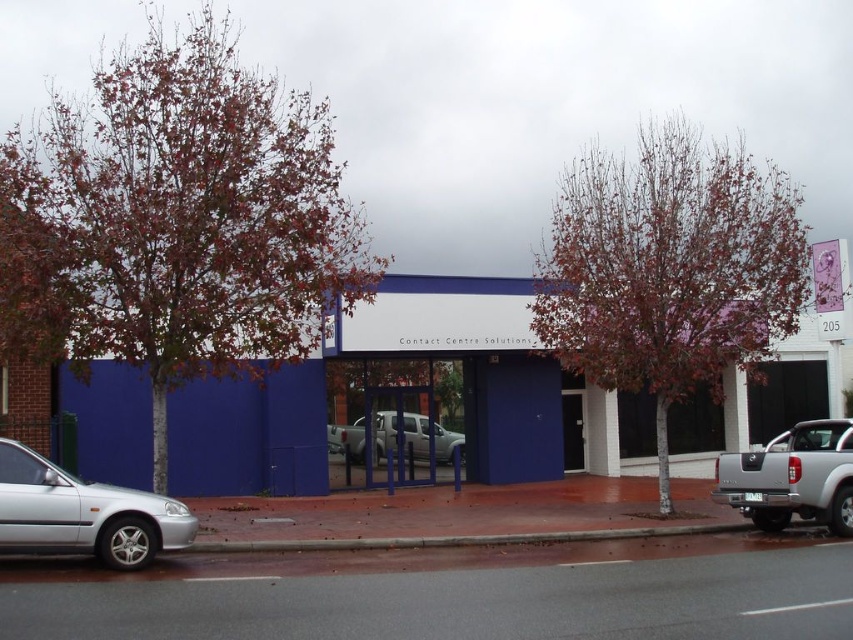
Is brown leafy tree at center taller than brown concrete curb at lower center?

Yes, brown leafy tree at center is taller than brown concrete curb at lower center.

The height and width of the screenshot is (640, 853). Describe the element at coordinates (670, 268) in the screenshot. I see `brown leafy tree at center` at that location.

This screenshot has width=853, height=640. In order to click on brown leafy tree at center in this screenshot , I will do `click(670, 268)`.

Does silver metallic car at lower left have a greater width compared to silver metallic pickup truck at right?

Indeed, silver metallic car at lower left has a greater width compared to silver metallic pickup truck at right.

Does silver metallic car at lower left have a smaller size compared to silver metallic pickup truck at right?

No, silver metallic car at lower left is not smaller than silver metallic pickup truck at right.

I want to click on silver metallic car at lower left, so pyautogui.click(x=83, y=513).

Is brown leafy tree at center bigger than silver metallic pickup truck at center?

Yes.

Between point (546, 292) and point (453, 438), which one is positioned behind?

Positioned behind is point (453, 438).

Between point (602, 266) and point (395, 419), which one is positioned in front?

Point (602, 266) is more forward.

You are a GUI agent. You are given a task and a screenshot of the screen. Output one action in this format:
    pyautogui.click(x=<x>, y=<y>)
    Task: Click on the brown leafy tree at center
    Image resolution: width=853 pixels, height=640 pixels.
    Given the screenshot: What is the action you would take?
    pyautogui.click(x=670, y=268)